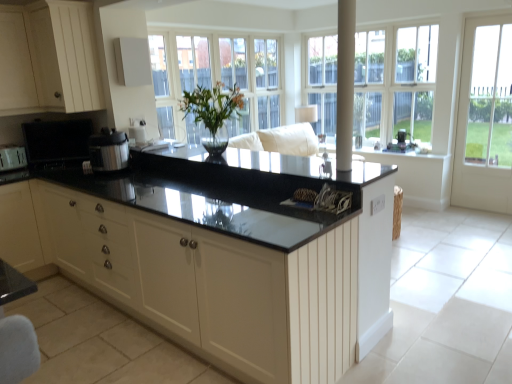
Find the location of a particular element. free space above metallic silver toaster at left, which ranks as the 3th appliance in back-to-front order (from a real-world perspective) is located at coordinates (8, 149).